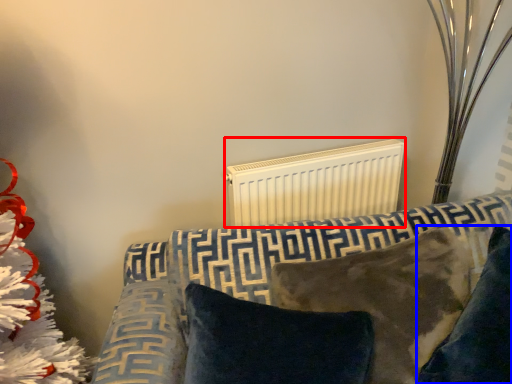
Question: Which object appears closest to the camera in this image, radiator (highlighted by a red box) or pillow (highlighted by a blue box)?

Choices:
 (A) radiator
 (B) pillow

Answer: (B)